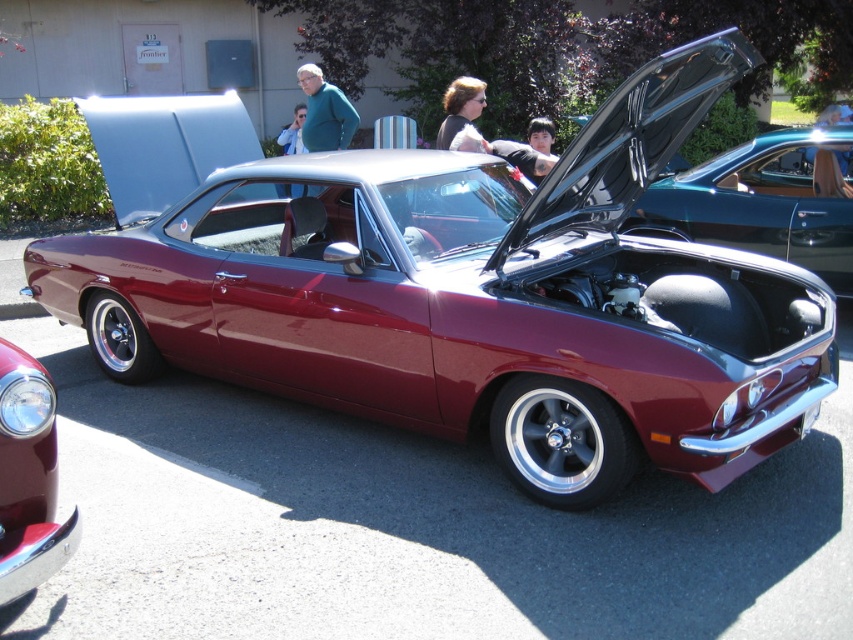
You are standing in front of the maroon muscle car at the exhibition. There are two points marked on the car, one at point (688, 170) and another at point (439, 140). From your perspective, which point is closer to the front of the car?

Point (439, 140) is closer to the front of the car because it is in front of point (688, 170).